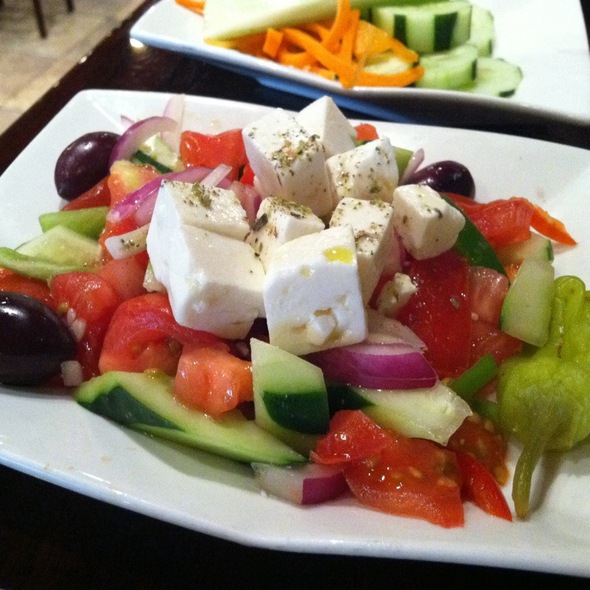
The image size is (590, 590). Find the location of `white plate`. white plate is located at coordinates (178, 27).